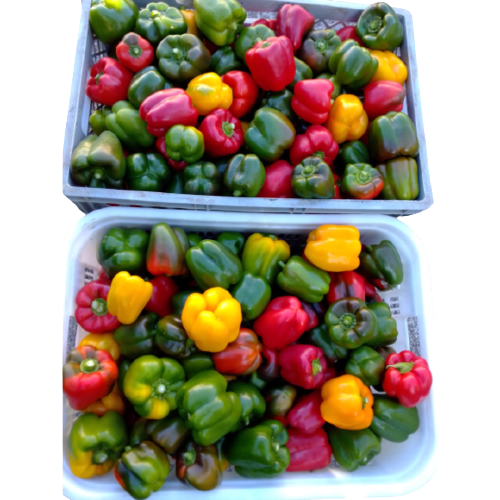
Locate an element on the screen. The height and width of the screenshot is (500, 500). handles is located at coordinates (413, 334), (71, 334), (87, 116), (252, 17), (404, 109).